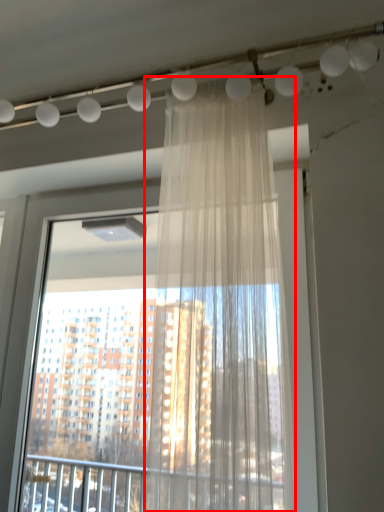
Question: From the image's perspective, where is curtain (annotated by the red box) located relative to window?

Choices:
 (A) above
 (B) below

Answer: (A)